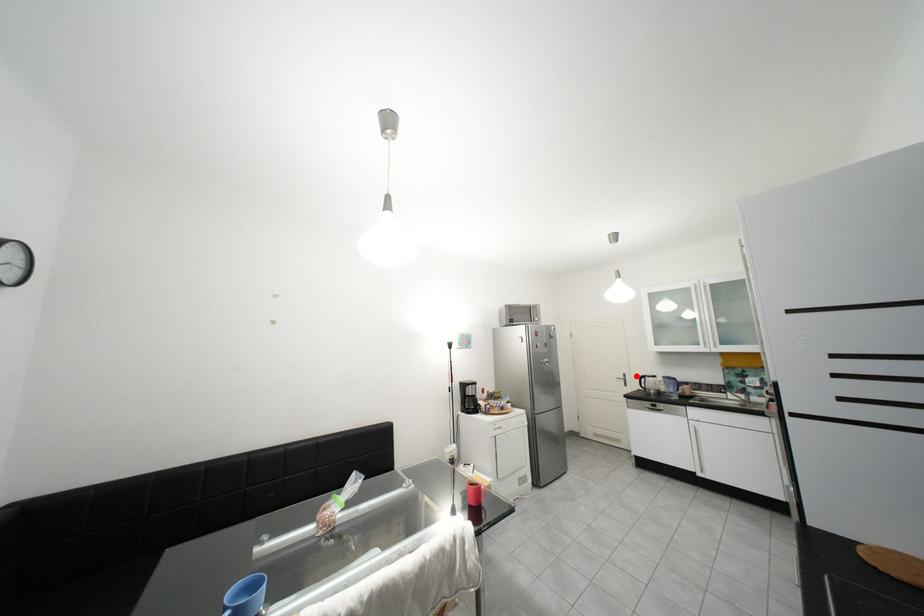
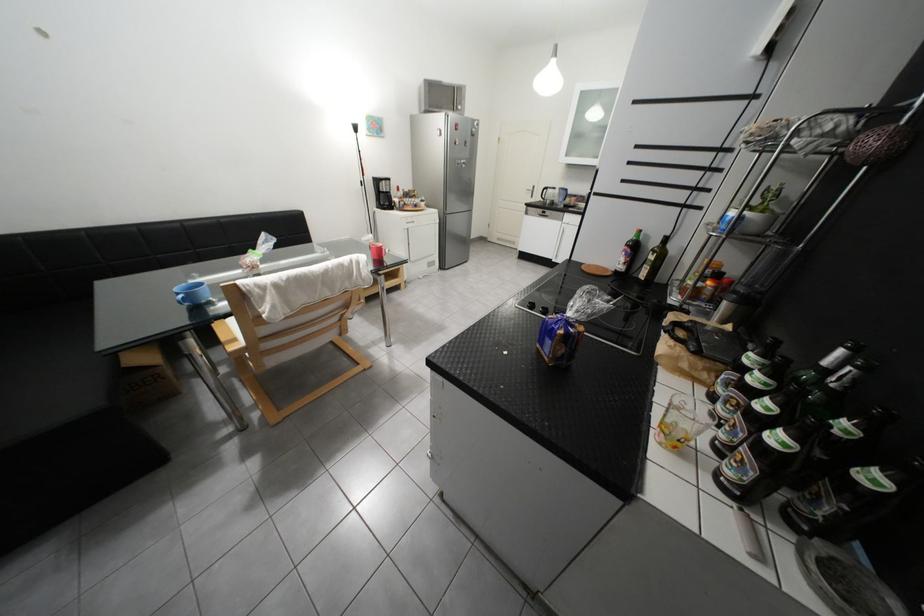
Locate, in the second image, the point that corresponds to the highlighted location in the first image.

(545, 188)